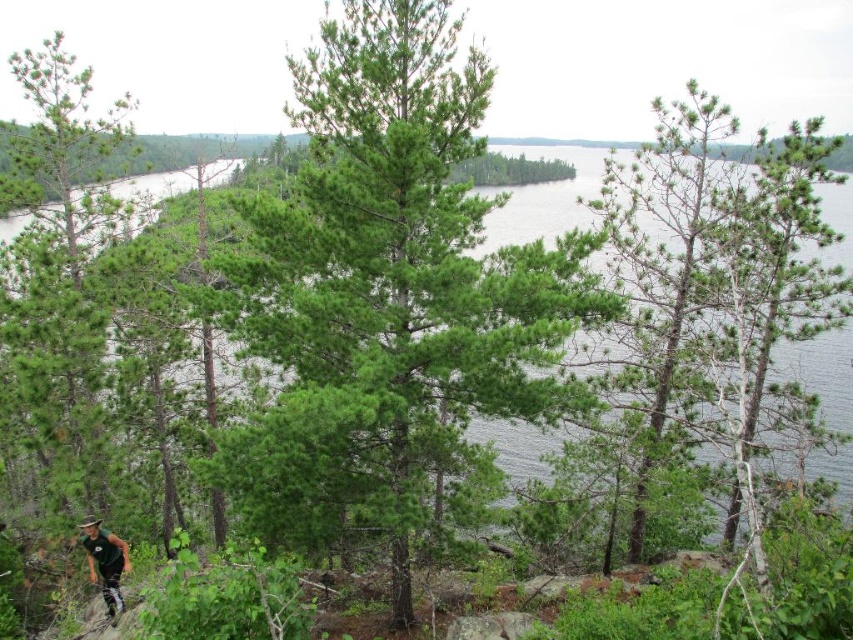
Question: Which object is farther from the camera taking this photo?

Choices:
 (A) green fabric mountain biker at lower left
 (B) clear water at center

Answer: (B)

Question: Does clear water at center have a greater width compared to green fabric mountain biker at lower left?

Choices:
 (A) no
 (B) yes

Answer: (B)

Question: Can you confirm if clear water at center is bigger than green fabric mountain biker at lower left?

Choices:
 (A) no
 (B) yes

Answer: (B)

Question: Which point appears farthest from the camera in this image?

Choices:
 (A) (93, 570)
 (B) (346, 22)
 (C) (834, 192)

Answer: (C)

Question: Which of these objects is positioned closest to the clear water at center?

Choices:
 (A) green fabric mountain biker at lower left
 (B) green matte tree at center

Answer: (B)

Question: Can you confirm if green matte tree at center is positioned below clear water at center?

Choices:
 (A) no
 (B) yes

Answer: (B)